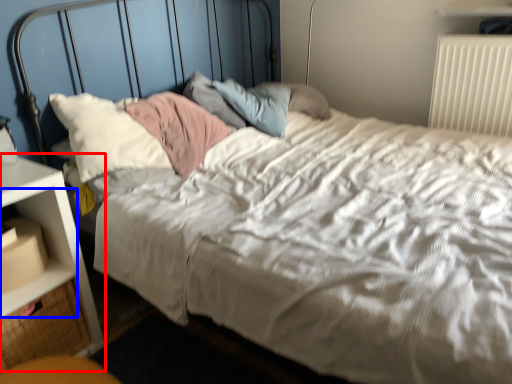
Question: Among these objects, which one is nearest to the camera, nightstand (highlighted by a red box) or shelf (highlighted by a blue box)?

Choices:
 (A) nightstand
 (B) shelf

Answer: (A)